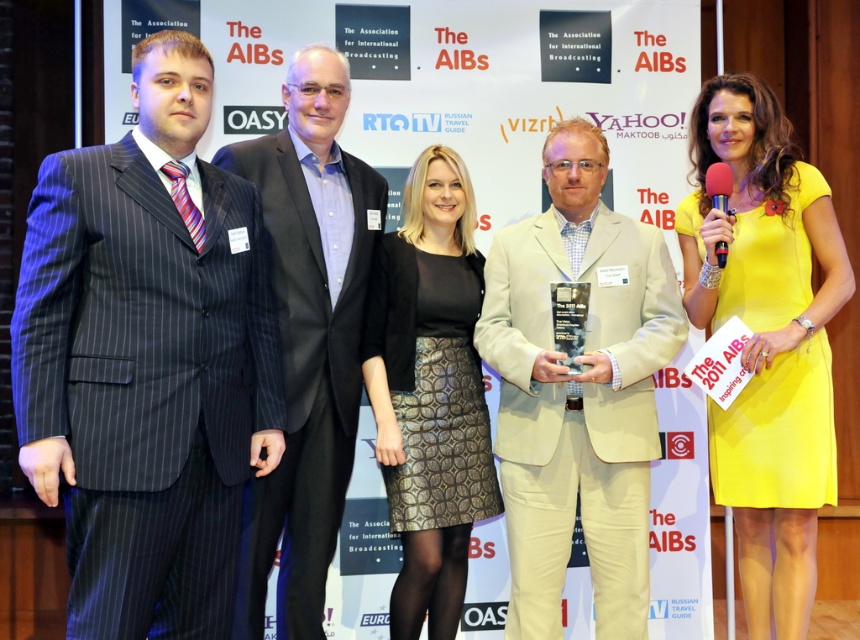
Question: Which point is farther to the camera?

Choices:
 (A) matte pinstripe suit at left
 (B) beige fabric suit at center
 (C) dark gray pinstripe suit at left
 (D) yellow satin dress at right

Answer: (B)

Question: Estimate the real-world distances between objects in this image. Which object is closer to the yellow satin dress at right?

Choices:
 (A) matte pinstripe suit at left
 (B) dark gray pinstripe suit at left
 (C) beige fabric suit at center

Answer: (C)

Question: Does beige fabric suit at center have a smaller size compared to black textured skirt at center?

Choices:
 (A) yes
 (B) no

Answer: (B)

Question: Can you confirm if beige fabric suit at center is smaller than dark gray pinstripe suit at left?

Choices:
 (A) yes
 (B) no

Answer: (B)

Question: Observing the image, what is the correct spatial positioning of matte pinstripe suit at left in reference to beige fabric suit at center?

Choices:
 (A) right
 (B) left

Answer: (B)

Question: Which of these objects is positioned farthest from the dark gray pinstripe suit at left?

Choices:
 (A) beige fabric suit at center
 (B) yellow satin dress at right
 (C) matte pinstripe suit at left

Answer: (B)